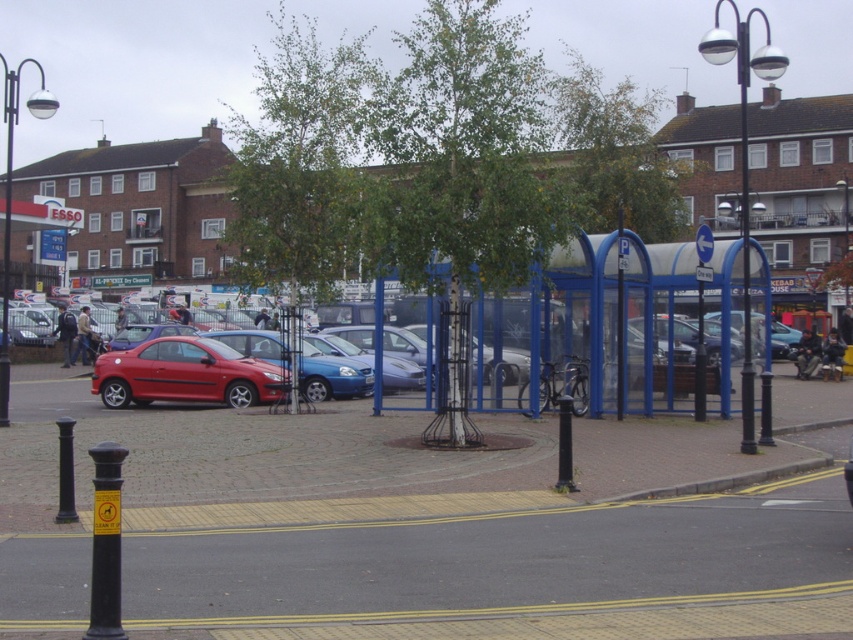
Is shiny red car at center-left above metallic silver streetlight at right?

No, shiny red car at center-left is not above metallic silver streetlight at right.

Is point (132, 397) farther from viewer compared to point (769, 438)?

Yes, point (132, 397) is farther from viewer.

The height and width of the screenshot is (640, 853). I want to click on shiny red car at center-left, so click(184, 374).

Does metallic silver streetlight at right have a greater width compared to matte black lamp post at left?

In fact, metallic silver streetlight at right might be narrower than matte black lamp post at left.

Does metallic silver streetlight at right appear over matte black lamp post at left?

Indeed, metallic silver streetlight at right is positioned over matte black lamp post at left.

What do you see at coordinates (743, 163) in the screenshot?
I see `metallic silver streetlight at right` at bounding box center [743, 163].

This screenshot has height=640, width=853. What are the coordinates of `metallic silver streetlight at right` in the screenshot? It's located at point(743,163).

Can you confirm if shiny red car at center-left is wider than matte black lamp post at left?

Incorrect, shiny red car at center-left's width does not surpass matte black lamp post at left's.

Which is in front, point (276, 369) or point (3, 406)?

Positioned in front is point (3, 406).

Image resolution: width=853 pixels, height=640 pixels. Identify the location of shiny red car at center-left. (184, 374).